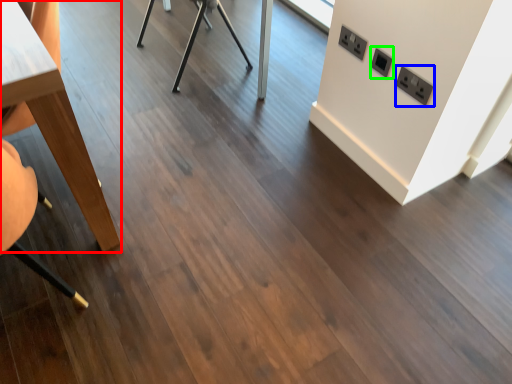
Question: Considering the real-world distances, which object is closest to table (highlighted by a red box)? electric outlet (highlighted by a blue box) or electric outlet (highlighted by a green box).

Choices:
 (A) electric outlet
 (B) electric outlet

Answer: (B)